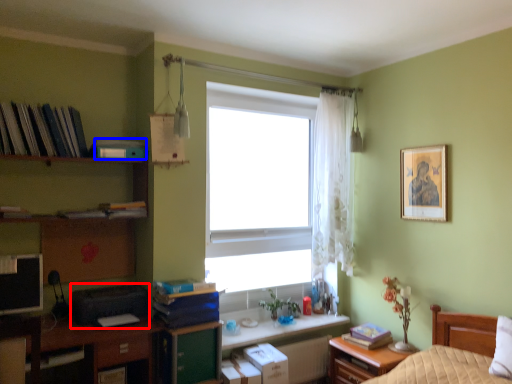
Question: Among these objects, which one is farthest to the camera, printer (highlighted by a red box) or book (highlighted by a blue box)?

Choices:
 (A) printer
 (B) book

Answer: (B)